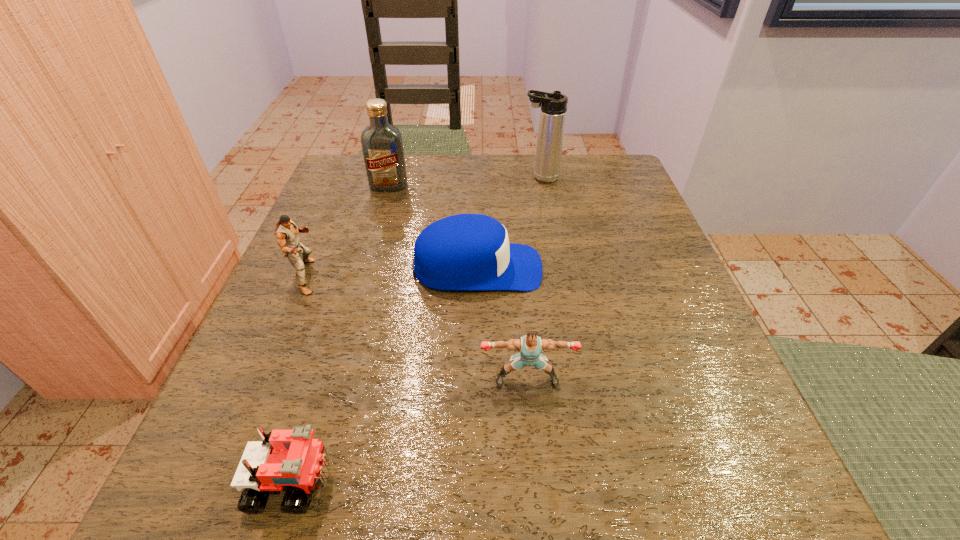
In order to click on thermos bottle in this screenshot , I will do `click(553, 111)`.

At what (x,y) coordinates should I click in order to perform the action: click on vodka. Please return your answer as a coordinate pair (x, y). The width and height of the screenshot is (960, 540). Looking at the image, I should click on (382, 145).

Locate an element on the screen. The height and width of the screenshot is (540, 960). the taller puncher is located at coordinates (286, 231).

At what (x,y) coordinates should I click in order to perform the action: click on the left puncher. Please return your answer as a coordinate pair (x, y). The image size is (960, 540). Looking at the image, I should click on (286, 231).

Locate an element on the screen. This screenshot has height=540, width=960. the nearer puncher is located at coordinates (530, 346).

What are the coordinates of `the fifth farthest object` in the screenshot? It's located at (530, 346).

Locate an element on the screen. Image resolution: width=960 pixels, height=540 pixels. baseball cap is located at coordinates (465, 252).

Identify the location of the nearest object. (286, 458).

You are a GUI agent. You are given a task and a screenshot of the screen. Output one action in this format:
    pyautogui.click(x=<x>, y=<y>)
    Task: Click on the vacant space positioned on the handle side of the thermos bottle
    This screenshot has width=960, height=540.
    Given the screenshot: What is the action you would take?
    pyautogui.click(x=492, y=178)

Where is `vacant space situated 0.390m on the handle side of the thermos bottle`? vacant space situated 0.390m on the handle side of the thermos bottle is located at coordinates (358, 178).